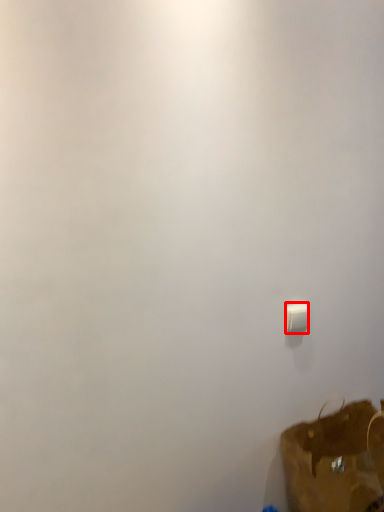
Question: From the image, what is the correct spatial relationship of light switch (annotated by the red box) in relation to luggage and bags?

Choices:
 (A) left
 (B) right

Answer: (A)